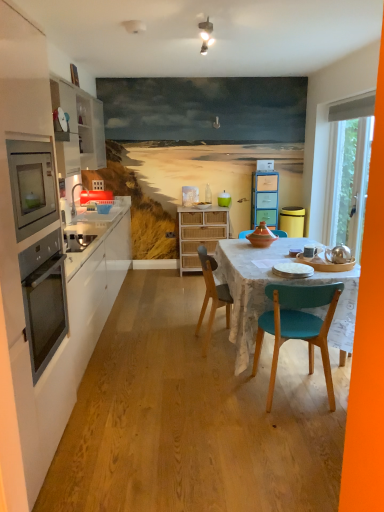
Question: Can you confirm if white fabric exhaust hood at upper right is thinner than white matte plate at center, the 2th plate when ordered from back to front?

Choices:
 (A) yes
 (B) no

Answer: (A)

Question: Is white fabric exhaust hood at upper right shorter than white matte plate at center, acting as the 2th plate starting from the left?

Choices:
 (A) yes
 (B) no

Answer: (B)

Question: From the image's perspective, is white fabric exhaust hood at upper right beneath white matte plate at center, acting as the 2th plate starting from the left?

Choices:
 (A) no
 (B) yes

Answer: (A)

Question: Is white fabric exhaust hood at upper right positioned in front of white matte plate at center, the 2th plate when ordered from back to front?

Choices:
 (A) yes
 (B) no

Answer: (B)

Question: Can white matte plate at center, the 2th plate when ordered from back to front, be found inside white fabric exhaust hood at upper right?

Choices:
 (A) no
 (B) yes

Answer: (A)

Question: Relative to white fabric exhaust hood at upper right, is matte white plywood at center in front or behind?

Choices:
 (A) front
 (B) behind

Answer: (A)

Question: From the image's perspective, is matte white plywood at center above or below white fabric exhaust hood at upper right?

Choices:
 (A) above
 (B) below

Answer: (B)

Question: Looking at their shapes, would you say matte white plywood at center is wider or thinner than white fabric exhaust hood at upper right?

Choices:
 (A) wide
 (B) thin

Answer: (A)

Question: From a real-world perspective, is matte white plywood at center physically located above or below white fabric exhaust hood at upper right?

Choices:
 (A) above
 (B) below

Answer: (B)

Question: Which is correct: woven rattan cabinet at center, placed as the second cabinetry when sorted from front to back, is inside matte white plywood at center, or outside of it?

Choices:
 (A) inside
 (B) outside

Answer: (B)

Question: From a real-world perspective, relative to matte white plywood at center, is woven rattan cabinet at center, placed as the second cabinetry when sorted from front to back, vertically above or below?

Choices:
 (A) above
 (B) below

Answer: (A)

Question: Does point (180, 254) appear closer or farther from the camera than point (160, 455)?

Choices:
 (A) farther
 (B) closer

Answer: (A)

Question: Considering the positions of woven rattan cabinet at center, positioned as the 2th cabinetry in left-to-right order, and matte white plywood at center in the image, is woven rattan cabinet at center, positioned as the 2th cabinetry in left-to-right order, taller or shorter than matte white plywood at center?

Choices:
 (A) short
 (B) tall

Answer: (B)

Question: Is stainless steel oven at left wider or thinner than white ceramic mug at table?

Choices:
 (A) wide
 (B) thin

Answer: (A)

Question: Is stainless steel oven at left spatially inside white ceramic mug at table, or outside of it?

Choices:
 (A) inside
 (B) outside

Answer: (B)